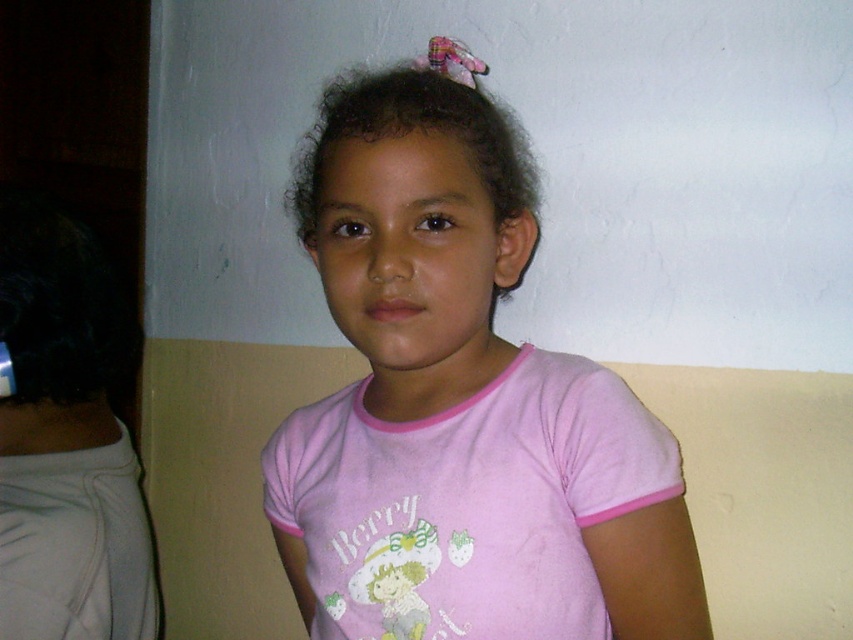
Can you confirm if pink cotton shirt at center is positioned to the left of white fabric at left?

In fact, pink cotton shirt at center is to the right of white fabric at left.

Who is shorter, pink cotton shirt at center or white fabric at left?

white fabric at left is shorter.

The height and width of the screenshot is (640, 853). What do you see at coordinates (461, 404) in the screenshot? I see `pink cotton shirt at center` at bounding box center [461, 404].

What are the coordinates of `pink cotton shirt at center` in the screenshot? It's located at (461, 404).

Does pink cotton shirt at center appear on the right side of dark curly hair at center?

Correct, you'll find pink cotton shirt at center to the right of dark curly hair at center.

Does pink cotton shirt at center have a lesser height compared to dark curly hair at center?

In fact, pink cotton shirt at center may be taller than dark curly hair at center.

Between point (526, 230) and point (401, 106), which one is positioned in front?

Point (401, 106) is in front.

This screenshot has height=640, width=853. I want to click on pink cotton shirt at center, so click(x=461, y=404).

Is white fabric at left to the right of dark curly hair at center from the viewer's perspective?

In fact, white fabric at left is to the left of dark curly hair at center.

Is white fabric at left behind dark curly hair at center?

Yes.

Identify the location of white fabric at left. (67, 440).